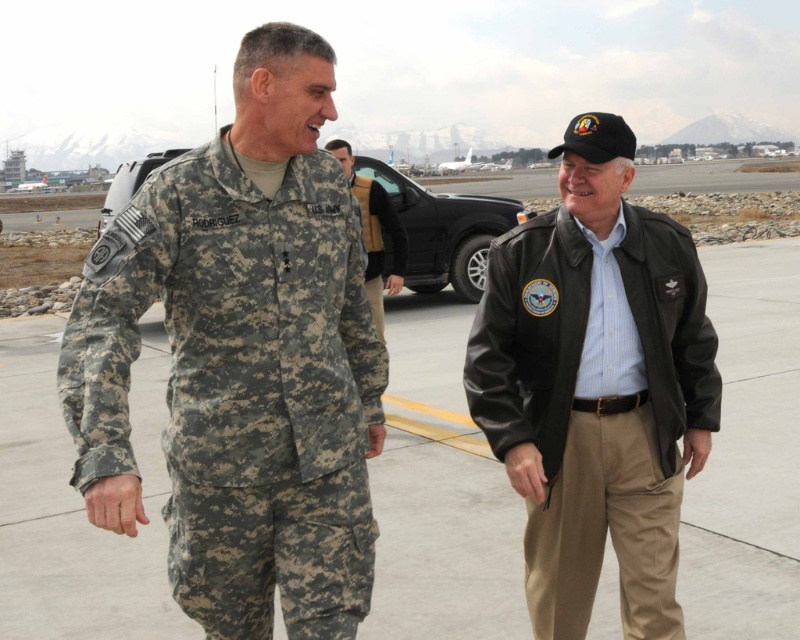
Question: Among these objects, which one is farthest from the camera?

Choices:
 (A) black leather jacket at center
 (B) camouflage uniform at left
 (C) camouflage fabric uniform at left

Answer: (B)

Question: Which is farther from the black leather jacket at center?

Choices:
 (A) camouflage fabric uniform at center
 (B) camouflage uniform at left

Answer: (A)

Question: Is camouflage uniform at left thinner than camouflage fabric uniform at center?

Choices:
 (A) no
 (B) yes

Answer: (A)

Question: Does camouflage uniform at left lie behind black leather jacket at center?

Choices:
 (A) yes
 (B) no

Answer: (A)

Question: Which of the following is the farthest from the observer?

Choices:
 (A) black leather jacket at center
 (B) camouflage fabric uniform at left

Answer: (A)

Question: Does camouflage uniform at left come in front of camouflage fabric uniform at left?

Choices:
 (A) yes
 (B) no

Answer: (B)